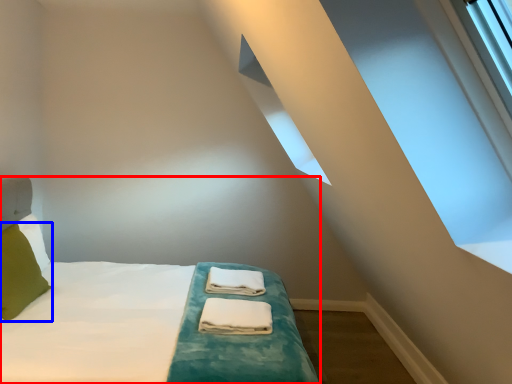
Question: Which object is closer to the camera taking this photo, bed (highlighted by a red box) or pillow (highlighted by a blue box)?

Choices:
 (A) bed
 (B) pillow

Answer: (A)